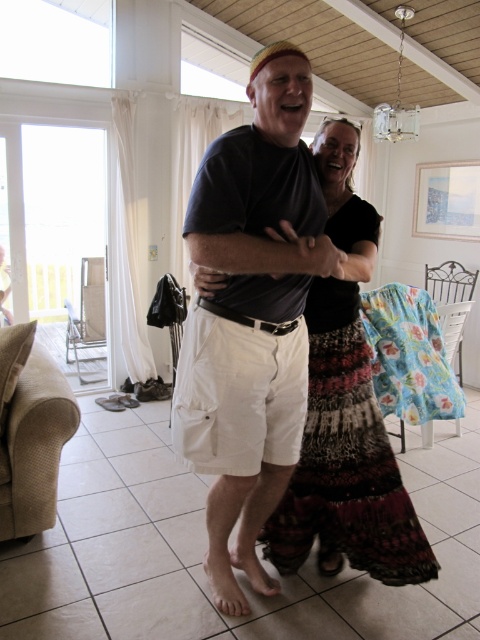
You are standing at the origin point in the room. There is a point marked at coordinates (x=342, y=413). Which object is this point located on?

The point at coordinates (x=342, y=413) is located on the matte black t shirt at center.